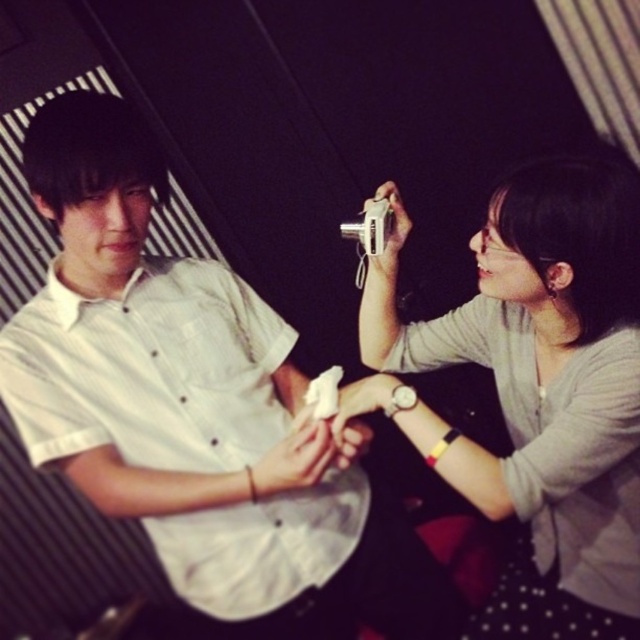
Question: Which point appears farthest from the camera in this image?

Choices:
 (A) (480, 252)
 (B) (248, 410)

Answer: (B)

Question: Among these objects, which one is farthest from the camera?

Choices:
 (A) matte gray camera at upper right
 (B) white matte shirt at center

Answer: (A)

Question: Which point is farther to the camera?

Choices:
 (A) white matte shirt at center
 (B) matte gray camera at upper right

Answer: (B)

Question: Does white matte shirt at center appear over matte gray camera at upper right?

Choices:
 (A) no
 (B) yes

Answer: (B)

Question: Does white matte shirt at center appear under matte gray camera at upper right?

Choices:
 (A) no
 (B) yes

Answer: (A)

Question: Considering the relative positions of white matte shirt at center and matte gray camera at upper right in the image provided, where is white matte shirt at center located with respect to matte gray camera at upper right?

Choices:
 (A) left
 (B) right

Answer: (A)